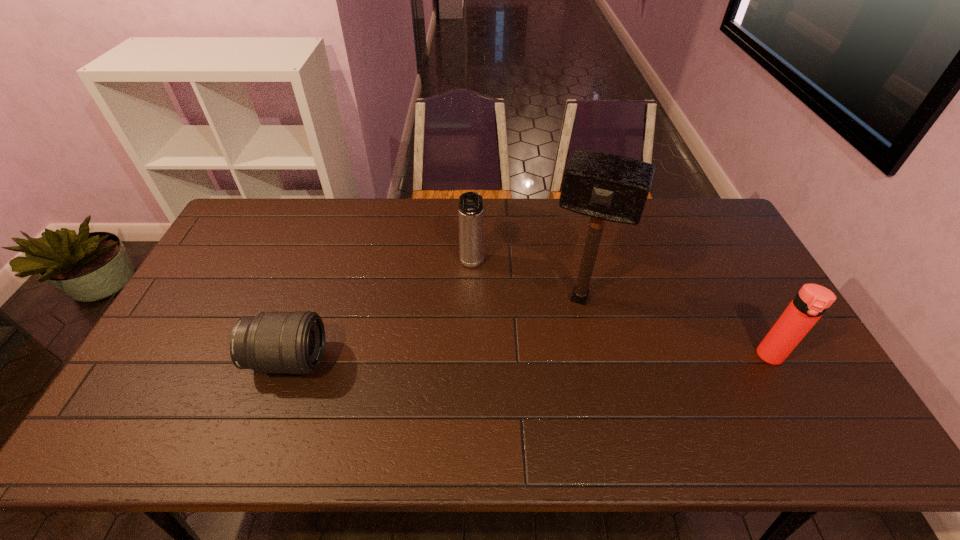
This screenshot has width=960, height=540. What are the coordinates of `vacant spot on the desktop that is between the shortest object and the right thermos bottle and is positioned on the handle side of the third object from right to left` in the screenshot? It's located at (471, 359).

Find the location of a particular element. free space on the desktop that is between the telephoto lens and the rightmost object and is positioned on the head of the third object from left to right is located at coordinates (560, 358).